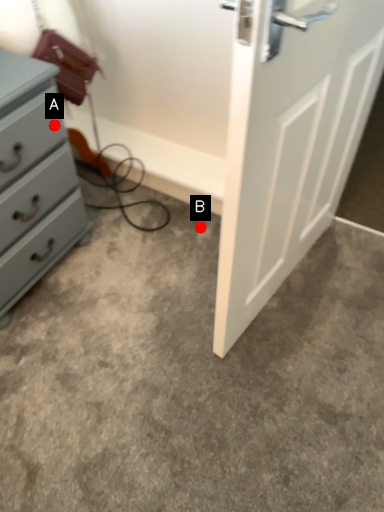
Question: Two points are circled on the image, labeled by A and B beside each circle. Which of the following is the farthest from the observer?

Choices:
 (A) A is further
 (B) B is further

Answer: (B)